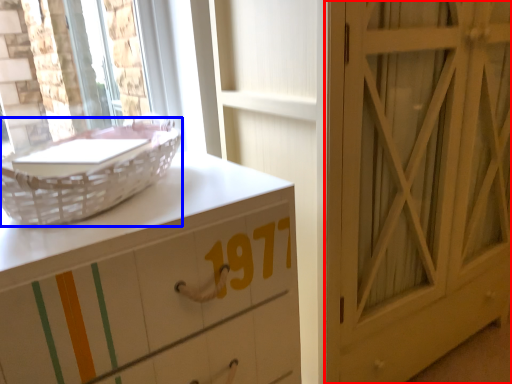
Question: Which point is closer to the camera, door (highlighted by a red box) or basket (highlighted by a blue box)?

Choices:
 (A) door
 (B) basket

Answer: (B)